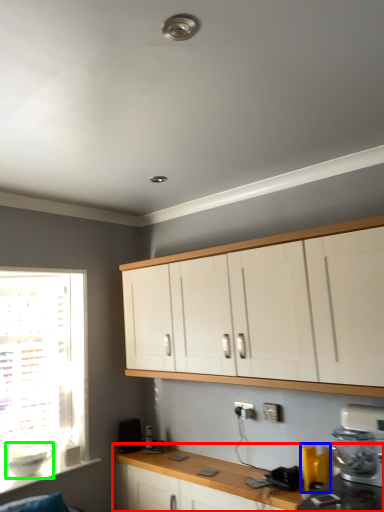
Question: Based on their relative distances, which object is farther from countertop (highlighted by a red box)? Choose from appliance (highlighted by a blue box) and appliance (highlighted by a green box).

Choices:
 (A) appliance
 (B) appliance

Answer: (B)